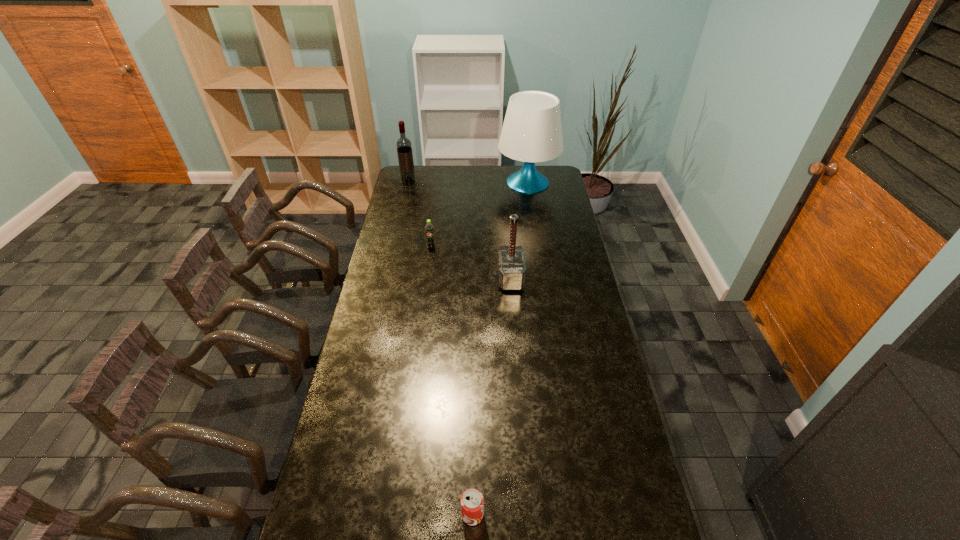
Find the location of a particular element. The image size is (960, 540). the fourth closest object relative to the second object from left to right is located at coordinates (472, 502).

Where is `object that is the third nearest to the taller soda can`? The width and height of the screenshot is (960, 540). object that is the third nearest to the taller soda can is located at coordinates (404, 147).

Locate an element on the screen. soda can that stands as the second closest to the fourth farthest object is located at coordinates (472, 502).

Where is `free spot that satisfies the following two spatial constraints: 1. on the front side of the nearest object; 2. on the left side of the wine bottle`? The image size is (960, 540). free spot that satisfies the following two spatial constraints: 1. on the front side of the nearest object; 2. on the left side of the wine bottle is located at coordinates (333, 515).

Locate an element on the screen. vacant space that satisfies the following two spatial constraints: 1. on the front label of the left soda can; 2. on the left side of the hammer is located at coordinates (427, 278).